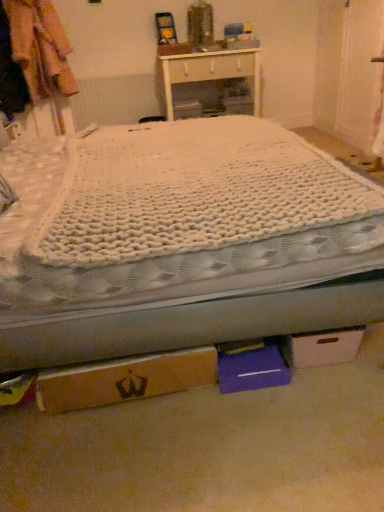
Locate an element on the screen. This screenshot has width=384, height=512. purple cardboard box at lower center, acting as the 1th storage box starting from the bottom is located at coordinates (252, 368).

Describe the element at coordinates (252, 368) in the screenshot. The width and height of the screenshot is (384, 512). I see `purple cardboard box at lower center, positioned as the first storage box in right-to-left order` at that location.

Find the location of `light brown fabric coat at left`. light brown fabric coat at left is located at coordinates (40, 48).

Where is `cardboard box at lower right, which ranks as the first cardboard box in right-to-left order`? This screenshot has height=512, width=384. cardboard box at lower right, which ranks as the first cardboard box in right-to-left order is located at coordinates (322, 347).

Describe the element at coordinates (193, 192) in the screenshot. This screenshot has width=384, height=512. I see `white knitted mattress at center` at that location.

I want to click on white glossy cabinet at upper center, so click(207, 69).

Find the location of a particular element. The width and height of the screenshot is (384, 512). white cardboard box at center, placed as the first storage box when sorted from back to front is located at coordinates (187, 109).

Considering the sizes of light brown fabric coat at left and white knitted blanket at center in the image, is light brown fabric coat at left bigger or smaller than white knitted blanket at center?

light brown fabric coat at left is smaller than white knitted blanket at center.

Is white knitted blanket at center at the back of light brown fabric coat at left?

No, white knitted blanket at center is not at the back of light brown fabric coat at left.

Which is further, (70, 91) or (334, 290)?

The point (70, 91) is farther.

Does point (103, 204) appear closer or farther from the camera than point (136, 362)?

Point (103, 204) is farther from the camera than point (136, 362).

How different are the orientations of white knitted mattress at center and brown cardboard box at lower center, the first cardboard box viewed from the left, in degrees?

The angle between the facing direction of white knitted mattress at center and the facing direction of brown cardboard box at lower center, the first cardboard box viewed from the left, is 84.9 degrees.

Considering the sizes of white knitted mattress at center and brown cardboard box at lower center, the first cardboard box viewed from the left, in the image, is white knitted mattress at center taller or shorter than brown cardboard box at lower center, the first cardboard box viewed from the left,?

Considering their sizes, white knitted mattress at center has less height than brown cardboard box at lower center, the first cardboard box viewed from the left.

Does white knitted mattress at center touch brown cardboard box at lower center, the first cardboard box viewed from the left?

No, white knitted mattress at center is not next to brown cardboard box at lower center, the first cardboard box viewed from the left.

Is light brown fabric coat at left thinner than brown cardboard box at lower center, the first cardboard box viewed from the left?

Incorrect, the width of light brown fabric coat at left is not less than that of brown cardboard box at lower center, the first cardboard box viewed from the left.

Are light brown fabric coat at left and brown cardboard box at lower center, the first cardboard box viewed from the left, far apart?

Absolutely, light brown fabric coat at left is distant from brown cardboard box at lower center, the first cardboard box viewed from the left.

Is light brown fabric coat at left outside of brown cardboard box at lower center, the first cardboard box viewed from the left?

Indeed, light brown fabric coat at left is completely outside brown cardboard box at lower center, the first cardboard box viewed from the left.

In the image, is light brown fabric coat at left positioned in front of or behind brown cardboard box at lower center, the first cardboard box viewed from the left?

light brown fabric coat at left is behind brown cardboard box at lower center, the first cardboard box viewed from the left.

How much distance is there between light brown fabric coat at left and white cardboard box at center, which appears as the 2th storage box when ordered from the bottom?

light brown fabric coat at left is 4.21 feet away from white cardboard box at center, which appears as the 2th storage box when ordered from the bottom.

Is light brown fabric coat at left not inside white cardboard box at center, the second storage box positioned from the right?

Yes, light brown fabric coat at left is not within white cardboard box at center, the second storage box positioned from the right.

Considering the positions of objects light brown fabric coat at left and white cardboard box at center, which appears as the first storage box when viewed from the left, in the image provided, who is in front, light brown fabric coat at left or white cardboard box at center, which appears as the first storage box when viewed from the left,?

light brown fabric coat at left.

Can you tell me how much light brown fabric coat at left and white cardboard box at center, which appears as the first storage box when viewed from the left, differ in facing direction?

They differ by 13.7 degrees in their facing directions.

Looking at this image, which of these two, white knitted blanket at center or white glossy cabinet at upper center, is wider?

white knitted blanket at center is wider.

The image size is (384, 512). Identify the location of nightstand to the left of white knitted blanket at center. (207, 69).

Considering the relative sizes of white knitted blanket at center and white glossy cabinet at upper center in the image provided, is white knitted blanket at center smaller than white glossy cabinet at upper center?

No, white knitted blanket at center is not smaller than white glossy cabinet at upper center.

Between point (24, 158) and point (182, 67), which one is positioned in front?

The point (24, 158) is more forward.

Is white cardboard box at center, which appears as the 2th storage box when ordered from the bottom, not inside light brown fabric coat at left?

Yes.

Would you consider white cardboard box at center, the 2th storage box when ordered from front to back, to be distant from light brown fabric coat at left?

That's right, there is a large distance between white cardboard box at center, the 2th storage box when ordered from front to back, and light brown fabric coat at left.

Considering the relative sizes of white cardboard box at center, the 2th storage box when ordered from front to back, and light brown fabric coat at left in the image provided, is white cardboard box at center, the 2th storage box when ordered from front to back, wider than light brown fabric coat at left?

Indeed, white cardboard box at center, the 2th storage box when ordered from front to back, has a greater width compared to light brown fabric coat at left.

Where is `clothing that is in front of the white cardboard box at center, placed as the first storage box when sorted from back to front`? The width and height of the screenshot is (384, 512). clothing that is in front of the white cardboard box at center, placed as the first storage box when sorted from back to front is located at coordinates (40, 48).

From the picture: Which of these two, brown cardboard box at lower center, the first cardboard box viewed from the left, or light brown fabric coat at left, is bigger?

Bigger between the two is light brown fabric coat at left.

Which object is positioned more to the right, brown cardboard box at lower center, the second cardboard box positioned from the right, or light brown fabric coat at left?

From the viewer's perspective, brown cardboard box at lower center, the second cardboard box positioned from the right, appears more on the right side.

Is brown cardboard box at lower center, the second cardboard box positioned from the right, not within light brown fabric coat at left?

Yes.

From the image's perspective, does brown cardboard box at lower center, the first cardboard box viewed from the left, appear lower than light brown fabric coat at left?

Yes.

Find the location of `bed in front of the light brown fabric coat at left`. bed in front of the light brown fabric coat at left is located at coordinates (178, 240).

I want to click on mattress above the brown cardboard box at lower center, the second cardboard box positioned from the right (from a real-world perspective), so click(x=193, y=192).

Which object lies nearer to the anchor point white glossy cabinet at upper center, white knitted blanket at center or white cardboard box at center, which ranks as the 1th storage box in top-to-bottom order?

The object closer to white glossy cabinet at upper center is white cardboard box at center, which ranks as the 1th storage box in top-to-bottom order.

From the image, which object appears to be nearer to white glossy cabinet at upper center, white knitted mattress at center or light brown fabric coat at left?

light brown fabric coat at left is positioned closer to the anchor white glossy cabinet at upper center.

Estimate the real-world distances between objects in this image. Which object is further from brown cardboard box at lower center, the first cardboard box viewed from the left, purple cardboard box at lower center, the 2th storage box viewed from the back, or white knitted blanket at center?

Among the two, white knitted blanket at center is located further to brown cardboard box at lower center, the first cardboard box viewed from the left.

Based on their spatial positions, is brown cardboard box at lower center, the second cardboard box positioned from the right, or cardboard box at lower right, positioned as the second cardboard box in left-to-right order, further from white cardboard box at center, placed as the first storage box when sorted from back to front?

Based on the image, brown cardboard box at lower center, the second cardboard box positioned from the right, appears to be further to white cardboard box at center, placed as the first storage box when sorted from back to front.

Estimate the real-world distances between objects in this image. Which object is closer to white knitted mattress at center, white knitted blanket at center or white cardboard box at center, which appears as the 2th storage box when ordered from the bottom?

The object closer to white knitted mattress at center is white knitted blanket at center.

Estimate the real-world distances between objects in this image. Which object is further from white knitted blanket at center, white cardboard box at center, which ranks as the 1th storage box in top-to-bottom order, or white glossy cabinet at upper center?

Based on the image, white cardboard box at center, which ranks as the 1th storage box in top-to-bottom order, appears to be further to white knitted blanket at center.

Based on their spatial positions, is white cardboard box at center, which appears as the 2th storage box when ordered from the bottom, or purple cardboard box at lower center, acting as the 1th storage box starting from the bottom, further from brown cardboard box at lower center, the first cardboard box viewed from the left?

white cardboard box at center, which appears as the 2th storage box when ordered from the bottom, lies further to brown cardboard box at lower center, the first cardboard box viewed from the left, than the other object.

Based on their spatial positions, is light brown fabric coat at left or purple cardboard box at lower center, acting as the 1th storage box starting from the bottom, closer to white knitted blanket at center?

Based on the image, purple cardboard box at lower center, acting as the 1th storage box starting from the bottom, appears to be nearer to white knitted blanket at center.

The width and height of the screenshot is (384, 512). In order to click on cardboard box positioned between purple cardboard box at lower center, the 2th storage box viewed from the back, and white cardboard box at center, placed as the first storage box when sorted from back to front, from near to far in this screenshot , I will do `click(322, 347)`.

I want to click on bed between white knitted mattress at center and purple cardboard box at lower center, acting as the 1th storage box starting from the bottom, from top to bottom, so click(x=178, y=240).

This screenshot has height=512, width=384. I want to click on clothing located between purple cardboard box at lower center, the 2th storage box viewed from the back, and white cardboard box at center, placed as the first storage box when sorted from back to front, in the depth direction, so click(40, 48).

Locate an element on the screen. This screenshot has height=512, width=384. cardboard box between light brown fabric coat at left and purple cardboard box at lower center, arranged as the 2th storage box when viewed from the left, in the vertical direction is located at coordinates (322, 347).